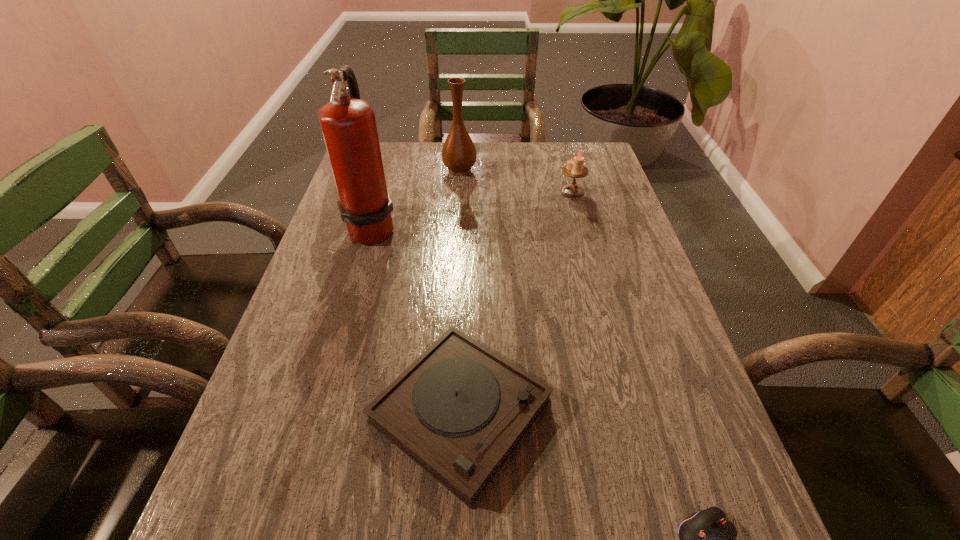
Find the location of a particular element. The height and width of the screenshot is (540, 960). vacant space located 0.220m on the front of the third shortest object is located at coordinates [x=587, y=245].

Locate an element on the screen. The image size is (960, 540). free spot located on the back of the phonograph record is located at coordinates (465, 305).

The image size is (960, 540). Find the location of `object that is at the far edge`. object that is at the far edge is located at coordinates (459, 154).

Locate an element on the screen. The width and height of the screenshot is (960, 540). object positioned at the left edge is located at coordinates (348, 124).

What are the coordinates of `object at the right edge` in the screenshot? It's located at (574, 168).

Find the location of a particular element. This screenshot has height=540, width=960. free space at the far edge of the desktop is located at coordinates (550, 144).

You are a GUI agent. You are given a task and a screenshot of the screen. Output one action in this format:
    pyautogui.click(x=<x>, y=<y>)
    Task: Click on the vacant region at the left edge of the desktop
    
    Given the screenshot: What is the action you would take?
    pyautogui.click(x=363, y=310)

I want to click on vacant space at the right edge of the desktop, so click(706, 451).

Locate an element on the screen. Image resolution: width=960 pixels, height=540 pixels. vacant region at the far right corner of the desktop is located at coordinates (586, 146).

The image size is (960, 540). In order to click on free space between the third farthest object and the vase in this screenshot , I will do `click(416, 198)`.